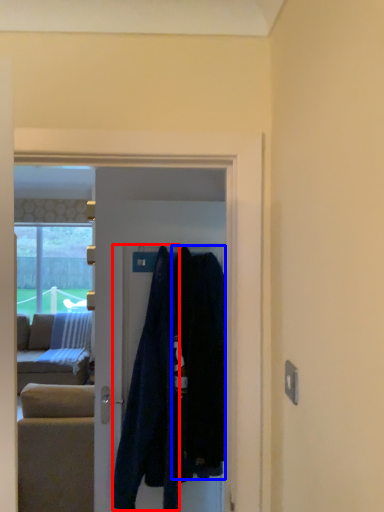
Question: Which point is further to the camera, clothing (highlighted by a red box) or clothing (highlighted by a blue box)?

Choices:
 (A) clothing
 (B) clothing

Answer: (A)